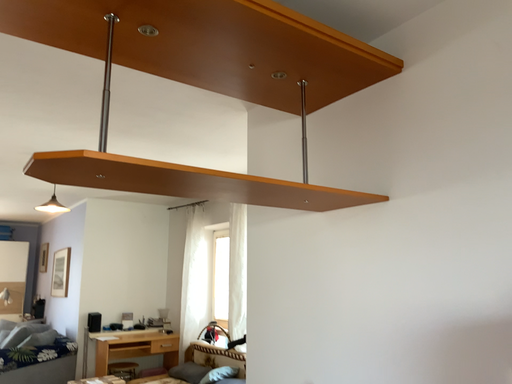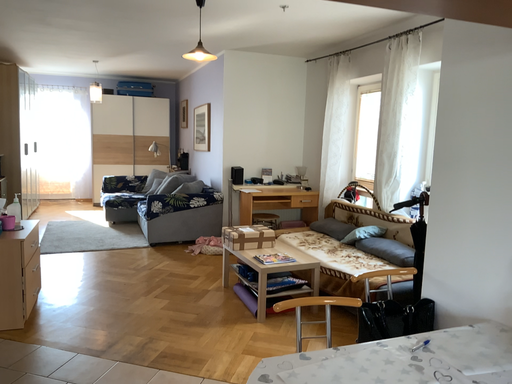
Question: How did the camera likely rotate when shooting the video?

Choices:
 (A) rotated left
 (B) rotated right

Answer: (A)